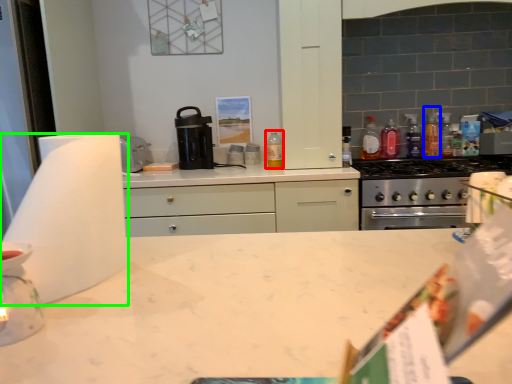
Question: Based on their relative distances, which object is farther from bottle (highlighted by a red box)? Choose from bottle (highlighted by a blue box) and paper towel (highlighted by a green box).

Choices:
 (A) bottle
 (B) paper towel

Answer: (B)